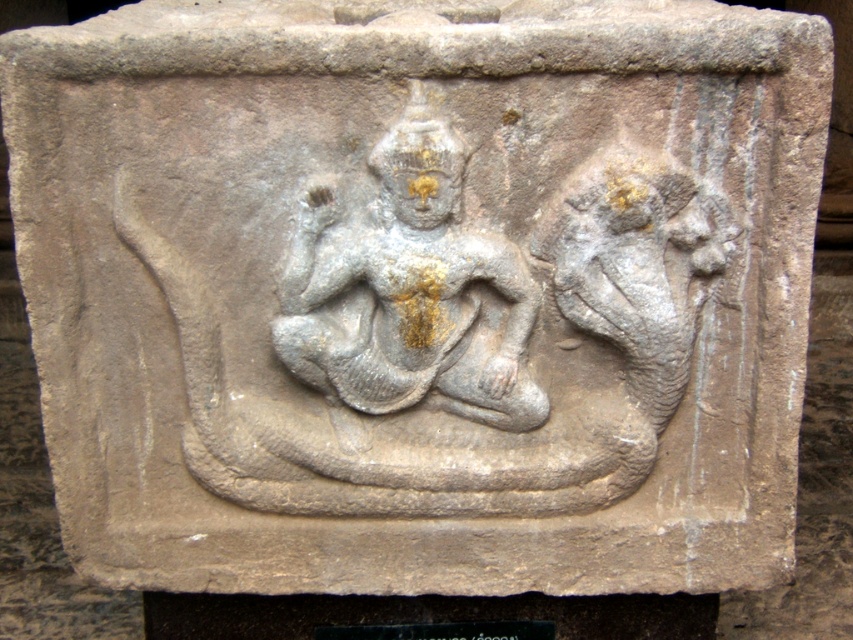
Question: Does gray stone carving at center have a larger size compared to gray stone deity at center?

Choices:
 (A) no
 (B) yes

Answer: (B)

Question: Is gray stone carving at center to the left of gray stone deity at center from the viewer's perspective?

Choices:
 (A) yes
 (B) no

Answer: (B)

Question: Which of the following is the farthest from the observer?

Choices:
 (A) gray stone deity at center
 (B) gray stone carving at center

Answer: (B)

Question: Can you confirm if gray stone carving at center is wider than gray stone deity at center?

Choices:
 (A) yes
 (B) no

Answer: (A)

Question: Which of the following is the farthest from the observer?

Choices:
 (A) gray stone carving at center
 (B) gray stone deity at center

Answer: (A)